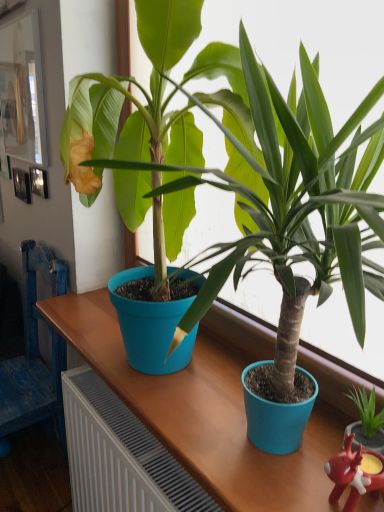
Where is `blue fabric chair at left`? blue fabric chair at left is located at coordinates (35, 355).

What is the approximate height of blue fabric chair at left?

It is 1.00 meters.

This screenshot has height=512, width=384. I want to click on rubberized red reindeer at lower right, so pyautogui.click(x=355, y=474).

In the scene shown: Is blue fabric chair at left in front of or behind rubberized red reindeer at lower right in the image?

blue fabric chair at left is positioned farther from the viewer than rubberized red reindeer at lower right.

Which is less distant, (25, 312) or (380, 476)?

Point (25, 312) is farther from the camera than point (380, 476).

Is blue fabric chair at left not near rubberized red reindeer at lower right?

Absolutely, blue fabric chair at left is distant from rubberized red reindeer at lower right.

Is rubberized red reindeer at lower right located outside blue fabric chair at left?

rubberized red reindeer at lower right lies outside blue fabric chair at left's area.

From the image's perspective, is rubberized red reindeer at lower right beneath blue fabric chair at left?

Incorrect, from the image's perspective, rubberized red reindeer at lower right is higher than blue fabric chair at left.

From a real-world perspective, is rubberized red reindeer at lower right on blue fabric chair at left?

Correct, in the physical world, rubberized red reindeer at lower right is higher than blue fabric chair at left.

From a real-world perspective, is white glossy picture frame at upper left over blue fabric chair at left?

Yes, from a real-world perspective, white glossy picture frame at upper left is above blue fabric chair at left.

Does white glossy picture frame at upper left lie behind blue fabric chair at left?

Yes.

From the image's perspective, between white glossy picture frame at upper left and blue fabric chair at left, which one is located above?

From the image's view, white glossy picture frame at upper left is above.

Is white glossy picture frame at upper left oriented towards blue fabric chair at left?

No.

How distant is rubberized red reindeer at lower right from white glossy picture frame at upper left?

They are 1.63 meters apart.

Between rubberized red reindeer at lower right and white glossy picture frame at upper left, which one is positioned in front?

rubberized red reindeer at lower right.

Considering the relative sizes of rubberized red reindeer at lower right and white glossy picture frame at upper left in the image provided, is rubberized red reindeer at lower right wider than white glossy picture frame at upper left?

Yes, rubberized red reindeer at lower right is wider than white glossy picture frame at upper left.

Is rubberized red reindeer at lower right facing towards white glossy picture frame at upper left?

No, rubberized red reindeer at lower right is not aimed at white glossy picture frame at upper left.

From the image's perspective, which object appears higher, white glossy picture frame at upper left or rubberized red reindeer at lower right?

From the image's view, white glossy picture frame at upper left is above.

In the scene shown: Can you confirm if white glossy picture frame at upper left is wider than rubberized red reindeer at lower right?

No, white glossy picture frame at upper left is not wider than rubberized red reindeer at lower right.

Is white glossy picture frame at upper left positioned with its back to rubberized red reindeer at lower right?

No, rubberized red reindeer at lower right is not at the back of white glossy picture frame at upper left.

Does white glossy picture frame at upper left appear on the left side of rubberized red reindeer at lower right?

Correct, you'll find white glossy picture frame at upper left to the left of rubberized red reindeer at lower right.

Between point (49, 258) and point (30, 106), which one is positioned in front?

Point (30, 106)

Relative to white glossy picture frame at upper left, is blue fabric chair at left in front or behind?

blue fabric chair at left is in front of white glossy picture frame at upper left.

At what (x,y) coordinates should I click in order to perform the action: click on chair lying below the white glossy picture frame at upper left (from the image's perspective). Please return your answer as a coordinate pair (x, y). The width and height of the screenshot is (384, 512). Looking at the image, I should click on (35, 355).

Can you confirm if blue fabric chair at left is shorter than white glossy picture frame at upper left?

No, blue fabric chair at left is not shorter than white glossy picture frame at upper left.

Image resolution: width=384 pixels, height=512 pixels. I want to click on chair lying behind the rubberized red reindeer at lower right, so click(35, 355).

Where is `toy on the right side of blue fabric chair at left`? The width and height of the screenshot is (384, 512). toy on the right side of blue fabric chair at left is located at coordinates (355, 474).

From the image, which object appears to be nearer to rubberized red reindeer at lower right, blue fabric chair at left or white glossy picture frame at upper left?

Among the two, blue fabric chair at left is located nearer to rubberized red reindeer at lower right.

Considering their positions, is white glossy picture frame at upper left positioned further to rubberized red reindeer at lower right than blue fabric chair at left?

white glossy picture frame at upper left is positioned further to the anchor rubberized red reindeer at lower right.

Estimate the real-world distances between objects in this image. Which object is further from white glossy picture frame at upper left, blue fabric chair at left or rubberized red reindeer at lower right?

The object further to white glossy picture frame at upper left is rubberized red reindeer at lower right.

Which object lies further to the anchor point blue fabric chair at left, rubberized red reindeer at lower right or white glossy picture frame at upper left?

rubberized red reindeer at lower right lies further to blue fabric chair at left than the other object.

Which object lies further to the anchor point white glossy picture frame at upper left, rubberized red reindeer at lower right or blue fabric chair at left?

rubberized red reindeer at lower right is positioned further to the anchor white glossy picture frame at upper left.

Which object lies nearer to the anchor point blue fabric chair at left, white glossy picture frame at upper left or rubberized red reindeer at lower right?

white glossy picture frame at upper left is closer to blue fabric chair at left.

Image resolution: width=384 pixels, height=512 pixels. Find the location of `toy between white glossy picture frame at upper left and blue fabric chair at left in the up-down direction`. toy between white glossy picture frame at upper left and blue fabric chair at left in the up-down direction is located at coordinates (355, 474).